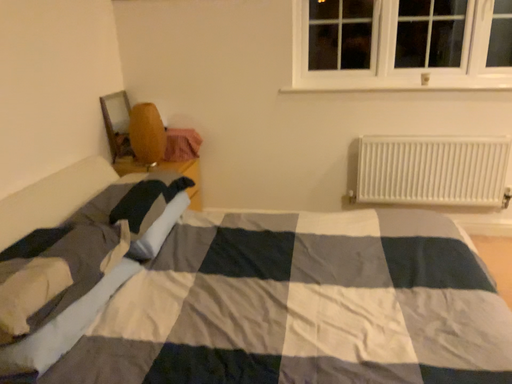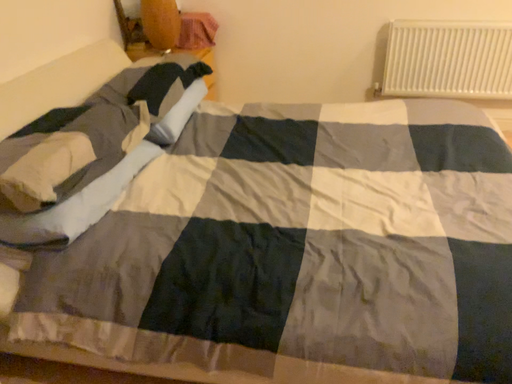
Question: Which way did the camera rotate in the video?

Choices:
 (A) rotated upward
 (B) rotated downward

Answer: (B)